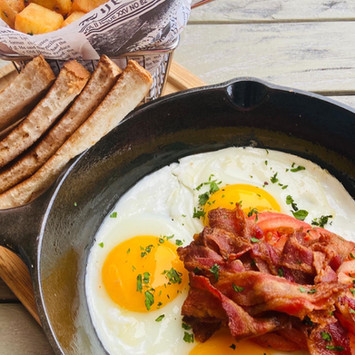
Locate an element on the screen. table is located at coordinates (253, 62).